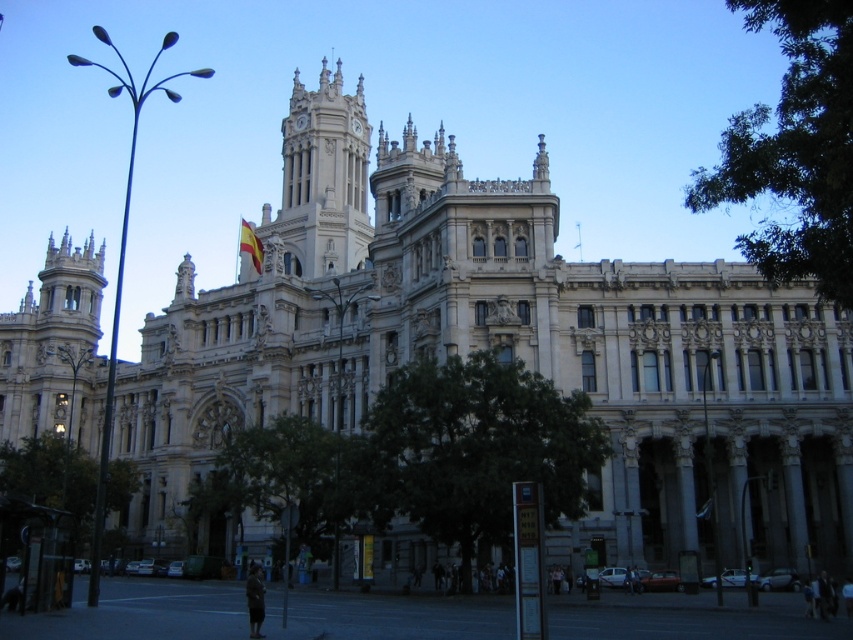
Question: Among these objects, which one is farthest from the camera?

Choices:
 (A) yellow-red striped fabric at upper center
 (B) white stone clock tower at upper center

Answer: (B)

Question: Considering the relative positions of white stone clock tower at upper center and yellow-red striped fabric at upper center in the image provided, where is white stone clock tower at upper center located with respect to yellow-red striped fabric at upper center?

Choices:
 (A) below
 (B) above

Answer: (B)

Question: Can you confirm if white stone clock tower at upper center is bigger than yellow-red striped fabric at upper center?

Choices:
 (A) yes
 (B) no

Answer: (A)

Question: Which point appears closest to the camera in this image?

Choices:
 (A) (289, 259)
 (B) (260, 259)

Answer: (B)

Question: Does white stone clock tower at upper center appear under yellow-red striped fabric at upper center?

Choices:
 (A) no
 (B) yes

Answer: (A)